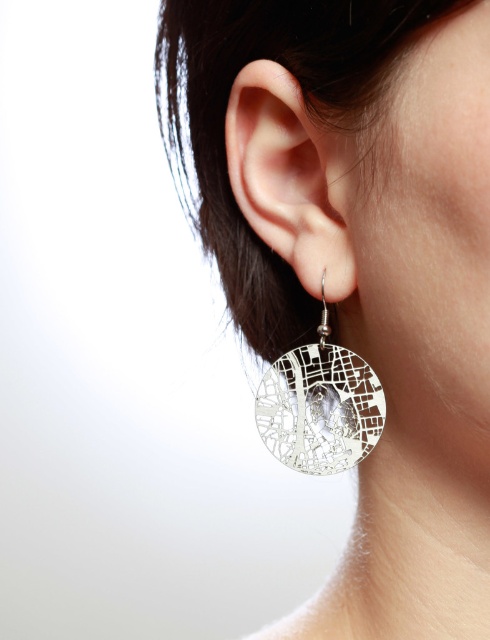
Question: Which of the following is the closest to the observer?

Choices:
 (A) silver/metallic/earring at lower right
 (B) silver metallic earring at center-left
 (C) silver metallic earrings at lower right

Answer: (C)

Question: Does silver metallic earrings at lower right have a lesser width compared to silver metallic earring at center-left?

Choices:
 (A) no
 (B) yes

Answer: (A)

Question: Does silver metallic earring at center-left appear under silver/metallic/earring at lower right?

Choices:
 (A) no
 (B) yes

Answer: (A)

Question: Where is silver metallic earring at center-left located in relation to silver/metallic/earring at lower right in the image?

Choices:
 (A) right
 (B) left

Answer: (B)

Question: Which point is closer to the camera?

Choices:
 (A) (273, 452)
 (B) (309, 148)
 (C) (443, 172)

Answer: (C)

Question: Which point is farther to the camera?

Choices:
 (A) silver/metallic/earring at lower right
 (B) silver metallic earring at center-left
 (C) silver metallic earrings at lower right

Answer: (A)